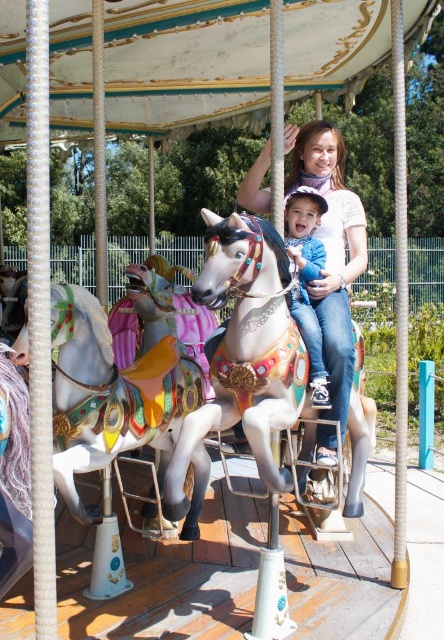
Based on the photo, in the carousel scene, there is a woman and a child riding a horse at point (252, 339). The carousel also has other horses. Where is the polished silver horse at center located?

The polished silver horse at center is located at point (252, 339).

You are a photographer taking a picture of the shiny metallic horse at center and the matte white shirt at center. Which object should you focus on first to ensure both are in sharp focus?

You should focus on the shiny metallic horse at center first because it is positioned under the matte white shirt at center, meaning it is closer to the camera. By focusing on the closer object, both will be in focus.